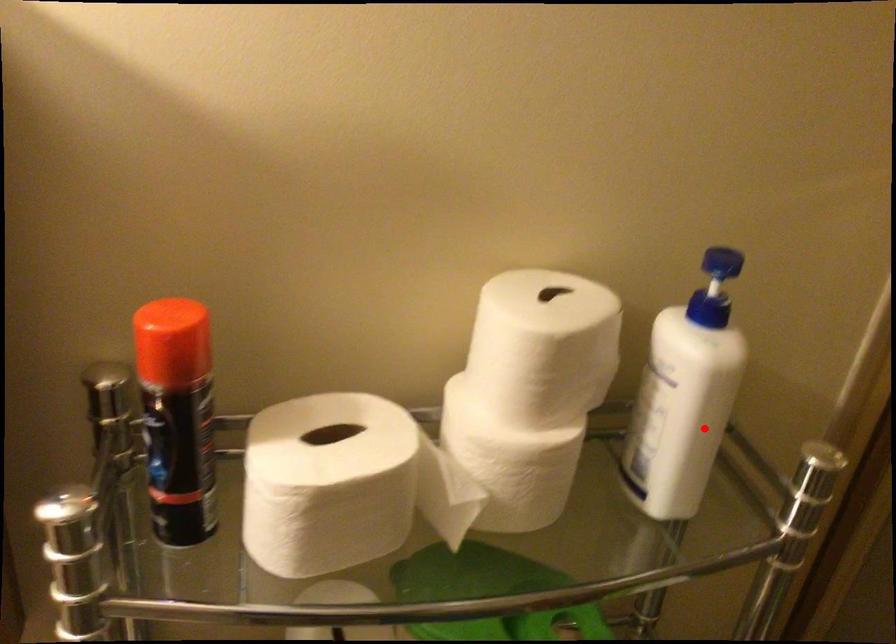
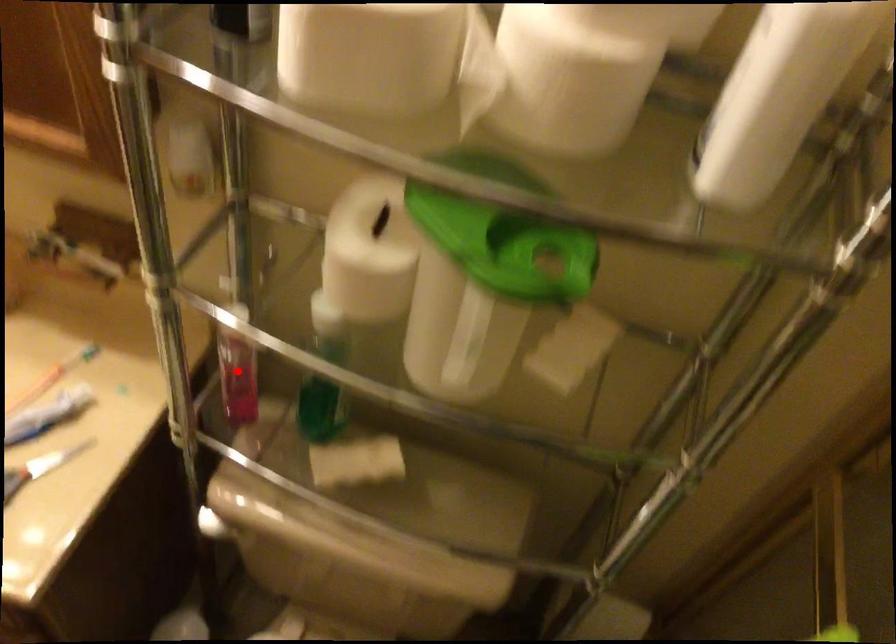
I am providing you with two images of the same scene from different viewpoints. A red point is marked on the first image and another point is marked on the second image. Is the marked point in image1 the same physical position as the marked point in image2?

No